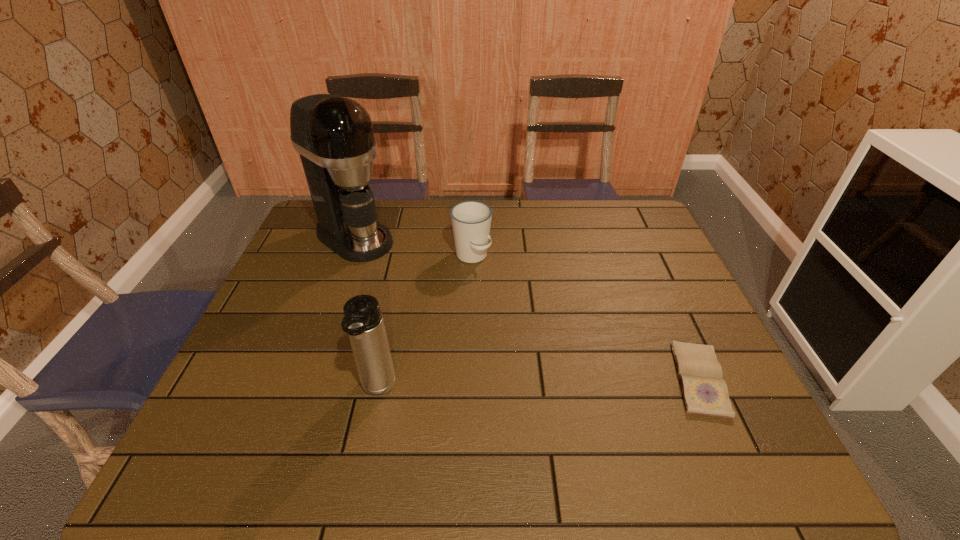
Where is `the second object from left to right`? Image resolution: width=960 pixels, height=540 pixels. the second object from left to right is located at coordinates (363, 320).

Identify the location of thermos bottle. (363, 320).

Image resolution: width=960 pixels, height=540 pixels. Identify the location of the shortest object. (704, 391).

Find the location of `the rightmost object`. the rightmost object is located at coordinates (704, 391).

The width and height of the screenshot is (960, 540). I want to click on cup, so click(471, 220).

You are a GUI agent. You are given a task and a screenshot of the screen. Output one action in this format:
    pyautogui.click(x=<x>, y=<y>)
    Task: Click on the second shortest object
    
    Given the screenshot: What is the action you would take?
    pyautogui.click(x=471, y=220)

Locate an element on the screen. This screenshot has width=960, height=540. the tallest object is located at coordinates pyautogui.click(x=334, y=136).

You are a GUI agent. You are given a task and a screenshot of the screen. Output one action in this format:
    pyautogui.click(x=<x>, y=<y>)
    Task: Click on the coffee maker
    The image size is (960, 540).
    Given the screenshot: What is the action you would take?
    pyautogui.click(x=334, y=136)

The image size is (960, 540). In order to click on vacant space located on the left of the shortest object in this screenshot , I will do `click(591, 379)`.

You are a GUI agent. You are given a task and a screenshot of the screen. Output one action in this format:
    pyautogui.click(x=<x>, y=<y>)
    Task: Click on the free space located with a handle on the side of the cup
    Image resolution: width=960 pixels, height=540 pixels.
    Given the screenshot: What is the action you would take?
    pyautogui.click(x=508, y=300)